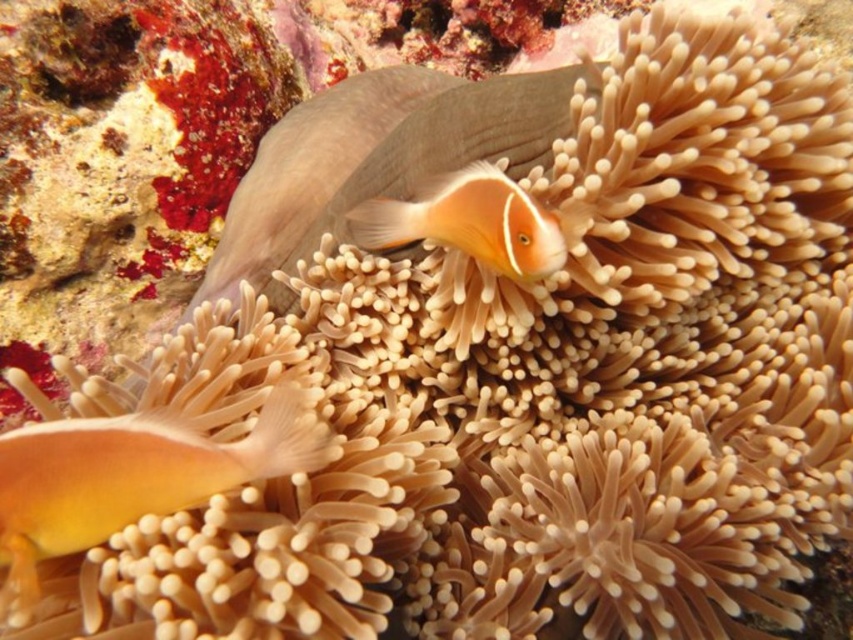
From the picture: You are a marine biologist observing the underwater scene. You notice two orange matte fish at center and orange matte clownfish at center. Which one is closer to you?

The orange matte fish at center is closer to you because it is further to the viewer than the orange matte clownfish at center.

You are a scuba diver observing the underwater scene. There are two points marked in the image. One is at coordinate point (192, 445) and the other at point (461, 228). Which point is closer to you?

Point (192, 445) is closer to the camera than point (461, 228).

You are a marine biologist observing an underwater scene. You need to locate the orange matte fish at center. What are its coordinates?

The orange matte fish at center is located at coordinates point (375, 157).